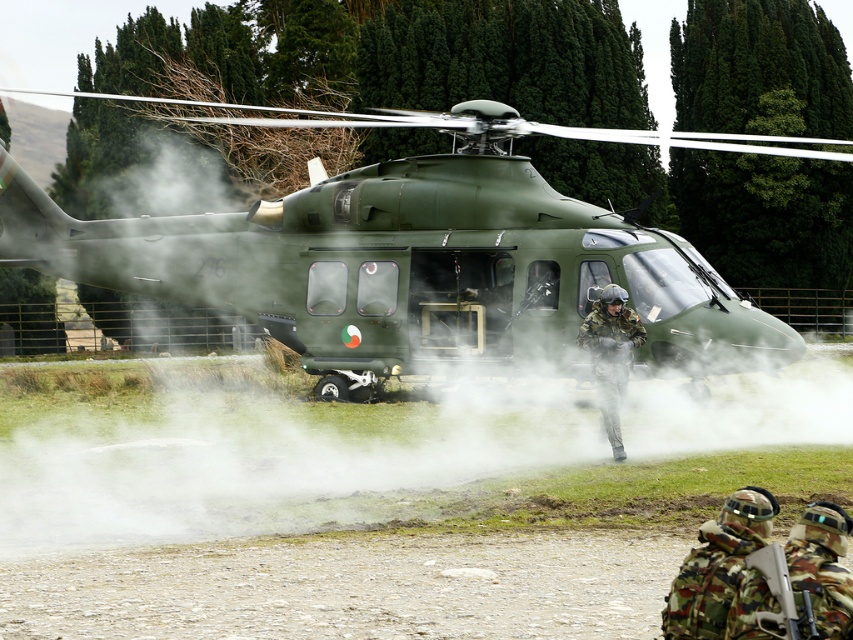
Question: Which point appears closest to the camera in this image?

Choices:
 (A) (608, 387)
 (B) (544, 342)

Answer: (A)

Question: Which point is farther to the camera?

Choices:
 (A) matte green helicopter at center
 (B) camouflage fabric helmet at center

Answer: (A)

Question: Can you confirm if matte green helicopter at center is wider than camouflage fabric helmet at center?

Choices:
 (A) no
 (B) yes

Answer: (B)

Question: Considering the relative positions of matte green helicopter at center and camouflage fabric helmet at center in the image provided, where is matte green helicopter at center located with respect to camouflage fabric helmet at center?

Choices:
 (A) above
 (B) below

Answer: (A)

Question: Is matte green helicopter at center smaller than camouflage fabric helmet at center?

Choices:
 (A) yes
 (B) no

Answer: (B)